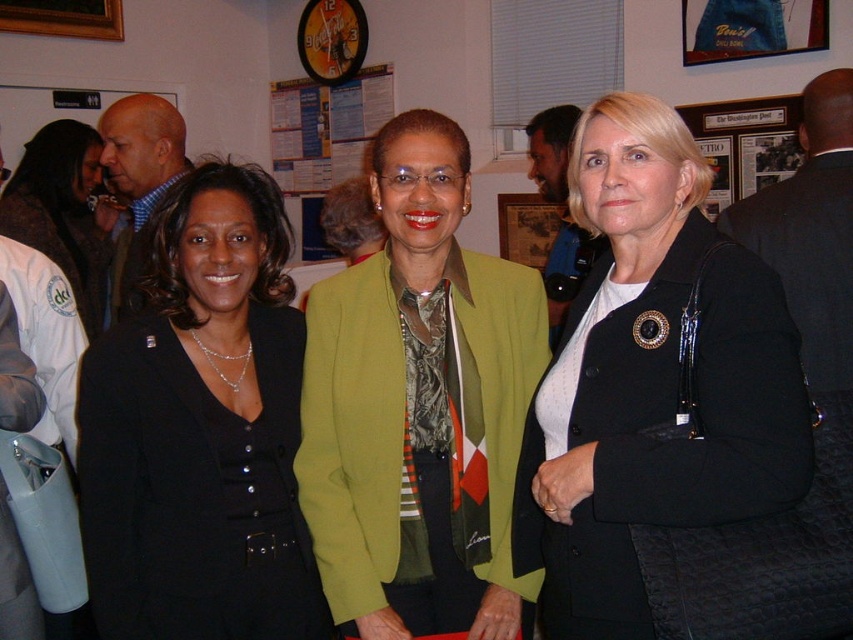
Based on the photo, can you confirm if denim fabric picture frame at upper right is positioned to the left of wooden framed picture at center?

In fact, denim fabric picture frame at upper right is to the right of wooden framed picture at center.

What do you see at coordinates (750, 28) in the screenshot?
I see `denim fabric picture frame at upper right` at bounding box center [750, 28].

Locate an element on the screen. The height and width of the screenshot is (640, 853). denim fabric picture frame at upper right is located at coordinates (750, 28).

Does wooden picture frame at upper left come in front of wooden framed picture at center?

That is False.

What do you see at coordinates (62, 17) in the screenshot?
I see `wooden picture frame at upper left` at bounding box center [62, 17].

Who is more distant from viewer, (57, 19) or (541, 202)?

The point (57, 19) is more distant.

At what (x,y) coordinates should I click in order to perform the action: click on wooden picture frame at upper left. Please return your answer as a coordinate pair (x, y). This screenshot has width=853, height=640. Looking at the image, I should click on (62, 17).

Is point (310, 134) more distant than point (73, 10)?

Yes, point (310, 134) is behind point (73, 10).

Find the location of a particular element. This screenshot has height=640, width=853. paper posters at center is located at coordinates (325, 128).

Locate an element on the screen. paper posters at center is located at coordinates (325, 128).